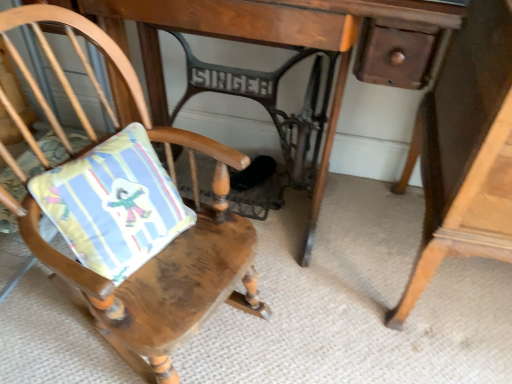
Question: Considering the relative sizes of wooden cushioned chair at center and wooden table at center in the image provided, is wooden cushioned chair at center thinner than wooden table at center?

Choices:
 (A) no
 (B) yes

Answer: (A)

Question: Is wooden cushioned chair at center oriented towards wooden table at center?

Choices:
 (A) yes
 (B) no

Answer: (B)

Question: Can you confirm if wooden cushioned chair at center is shorter than wooden table at center?

Choices:
 (A) no
 (B) yes

Answer: (B)

Question: Considering the relative sizes of wooden cushioned chair at center and wooden table at center in the image provided, is wooden cushioned chair at center taller than wooden table at center?

Choices:
 (A) yes
 (B) no

Answer: (B)

Question: Is wooden cushioned chair at center at the right side of wooden table at center?

Choices:
 (A) yes
 (B) no

Answer: (B)

Question: Considering the relative sizes of wooden cushioned chair at center and wooden table at center in the image provided, is wooden cushioned chair at center bigger than wooden table at center?

Choices:
 (A) yes
 (B) no

Answer: (B)

Question: From a real-world perspective, is wooden cushioned chair at center physically above striped fabric cushion at left?

Choices:
 (A) yes
 (B) no

Answer: (B)

Question: Is wooden cushioned chair at center not inside striped fabric cushion at left?

Choices:
 (A) no
 (B) yes

Answer: (B)

Question: Considering the relative sizes of wooden cushioned chair at center and striped fabric cushion at left in the image provided, is wooden cushioned chair at center smaller than striped fabric cushion at left?

Choices:
 (A) no
 (B) yes

Answer: (A)

Question: Is wooden cushioned chair at center positioned with its back to striped fabric cushion at left?

Choices:
 (A) yes
 (B) no

Answer: (A)

Question: Considering the relative sizes of wooden cushioned chair at center and striped fabric cushion at left in the image provided, is wooden cushioned chair at center bigger than striped fabric cushion at left?

Choices:
 (A) yes
 (B) no

Answer: (A)

Question: Could you tell me if wooden cushioned chair at center is turned towards striped fabric cushion at left?

Choices:
 (A) yes
 (B) no

Answer: (A)

Question: Can you confirm if striped fabric cushion at left is bigger than wooden table at center?

Choices:
 (A) no
 (B) yes

Answer: (A)